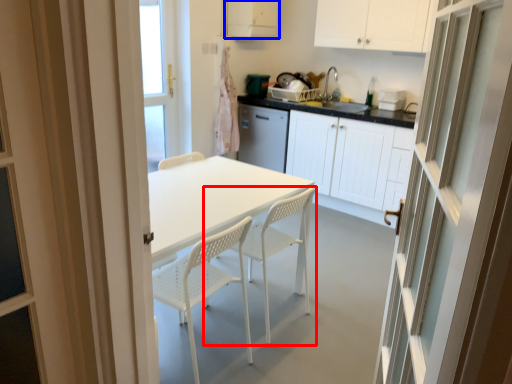
Question: Among these objects, which one is nearest to the camera, chair (highlighted by a red box) or cabinetry (highlighted by a blue box)?

Choices:
 (A) chair
 (B) cabinetry

Answer: (A)